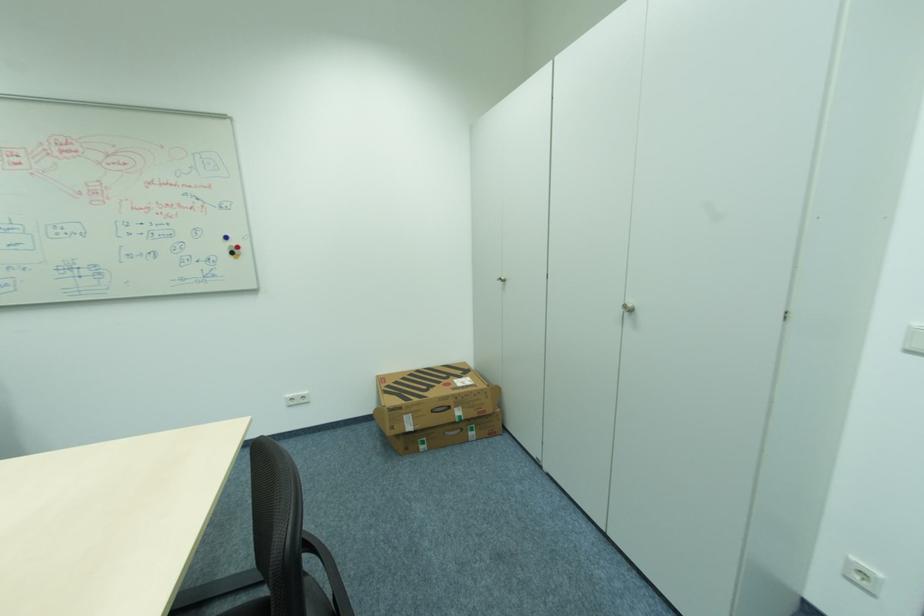
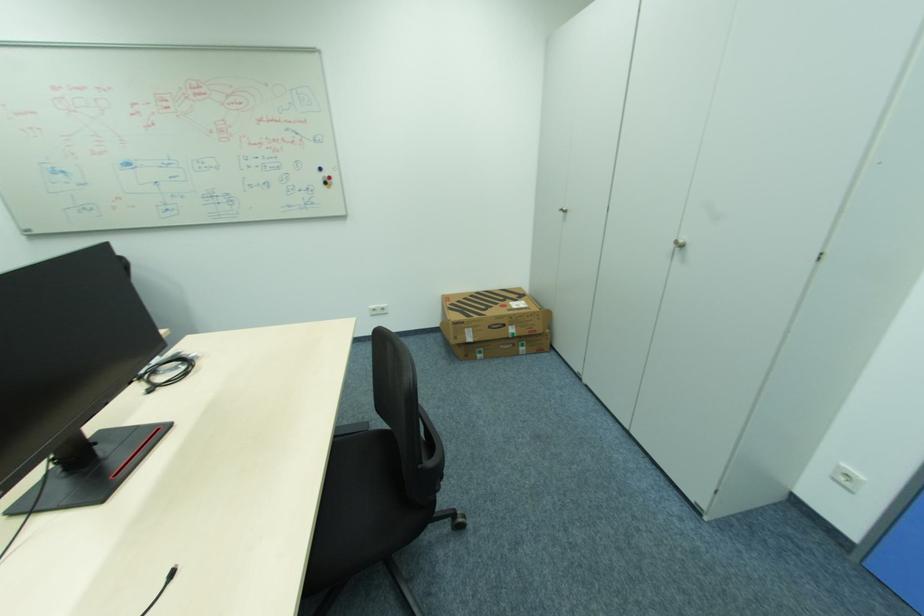
In the second image, find the point that corresponds to (x=237, y=254) in the first image.

(331, 184)